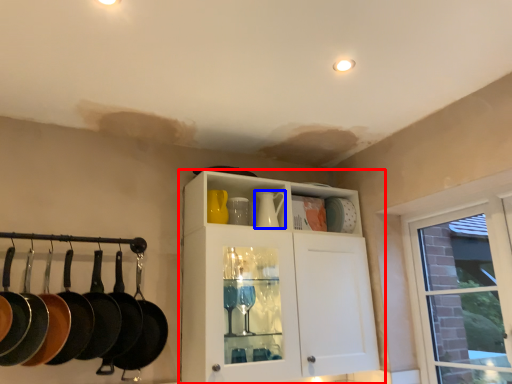
Question: Which of the following is the farthest to the observer, cabinetry (highlighted by a red box) or tea pot (highlighted by a blue box)?

Choices:
 (A) cabinetry
 (B) tea pot

Answer: (B)